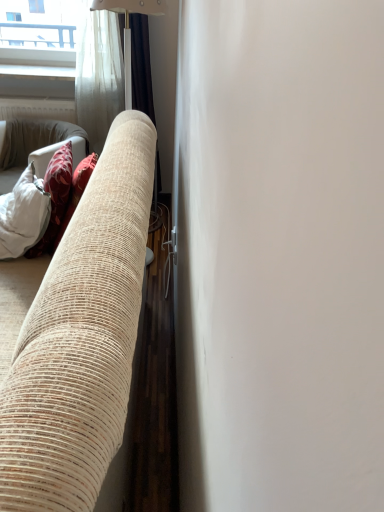
Question: Considering the positions of point (117, 307) and point (144, 5), is point (117, 307) closer or farther from the camera than point (144, 5)?

Choices:
 (A) closer
 (B) farther

Answer: (A)

Question: In terms of width, does beige textured fabric couch at left look wider or thinner when compared to silky beige curtain at center?

Choices:
 (A) wide
 (B) thin

Answer: (A)

Question: Looking at the image, does beige textured fabric couch at left seem bigger or smaller compared to silky beige curtain at center?

Choices:
 (A) small
 (B) big

Answer: (B)

Question: In the image, is silky beige curtain at center positioned in front of or behind beige textured fabric couch at left?

Choices:
 (A) behind
 (B) front

Answer: (A)

Question: Based on their sizes in the image, would you say silky beige curtain at center is bigger or smaller than beige textured fabric couch at left?

Choices:
 (A) small
 (B) big

Answer: (A)

Question: Considering the positions of silky beige curtain at center and beige textured fabric couch at left in the image, is silky beige curtain at center wider or thinner than beige textured fabric couch at left?

Choices:
 (A) wide
 (B) thin

Answer: (B)

Question: Would you say silky beige curtain at center is inside or outside beige textured fabric couch at left?

Choices:
 (A) inside
 (B) outside

Answer: (B)